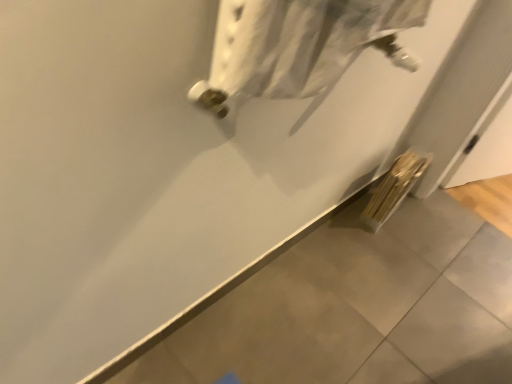
What do you see at coordinates (394, 188) in the screenshot? I see `wooden sticks at lower right` at bounding box center [394, 188].

Where is `wooden sticks at lower right`? This screenshot has height=384, width=512. wooden sticks at lower right is located at coordinates (394, 188).

This screenshot has width=512, height=384. In order to click on white textured towel at upper center in this screenshot , I will do `click(298, 47)`.

This screenshot has width=512, height=384. What do you see at coordinates (298, 47) in the screenshot?
I see `white textured towel at upper center` at bounding box center [298, 47].

In order to face white textured towel at upper center, should I rotate leftwards or rightwards?

Turn right approximately 4.911 degrees to face it.

Measure the distance between white textured towel at upper center and camera.

They are 55.57 centimeters apart.

This screenshot has height=384, width=512. I want to click on wooden sticks at lower right, so click(x=394, y=188).

Which object is positioned more to the left, wooden sticks at lower right or white textured towel at upper center?

From the viewer's perspective, white textured towel at upper center appears more on the left side.

Which object is closer to the camera taking this photo, wooden sticks at lower right or white textured towel at upper center?

white textured towel at upper center.

Is point (418, 160) closer or farther from the camera than point (362, 3)?

Point (418, 160) appears to be farther away from the viewer than point (362, 3).

From the image's perspective, is wooden sticks at lower right below white textured towel at upper center?

Yes, from the image's perspective, wooden sticks at lower right is below white textured towel at upper center.

From a real-world perspective, relative to white textured towel at upper center, is wooden sticks at lower right vertically above or below?

In terms of real-world spatial position, wooden sticks at lower right is below white textured towel at upper center.

Which object is thinner, wooden sticks at lower right or white textured towel at upper center?

white textured towel at upper center.

Who is taller, wooden sticks at lower right or white textured towel at upper center?

Standing taller between the two is wooden sticks at lower right.

Considering the sizes of wooden sticks at lower right and white textured towel at upper center in the image, is wooden sticks at lower right bigger or smaller than white textured towel at upper center?

In the image, wooden sticks at lower right appears to be larger than white textured towel at upper center.

Could white textured towel at upper center be considered to be inside wooden sticks at lower right?

No, white textured towel at upper center is not surrounded by wooden sticks at lower right.

Does wooden sticks at lower right touch white textured towel at upper center?

No, wooden sticks at lower right is not in contact with white textured towel at upper center.

Is wooden sticks at lower right turned away from white textured towel at upper center?

No, wooden sticks at lower right is not facing away from white textured towel at upper center.

Identify the location of wide located above the wooden sticks at lower right (from a real-world perspective). This screenshot has height=384, width=512. (298, 47).

Is white textured towel at upper center to the right of wooden sticks at lower right from the viewer's perspective?

Incorrect, white textured towel at upper center is not on the right side of wooden sticks at lower right.

Considering the positions of objects white textured towel at upper center and wooden sticks at lower right in the image provided, who is in front, white textured towel at upper center or wooden sticks at lower right?

Positioned in front is white textured towel at upper center.

Is point (258, 77) positioned behind point (413, 161)?

That is False.

From the image's perspective, between white textured towel at upper center and wooden sticks at lower right, who is located below?

From the image's view, wooden sticks at lower right is below.

From a real-world perspective, relative to wooden sticks at lower right, is white textured towel at upper center vertically above or below?

white textured towel at upper center is above wooden sticks at lower right.

Which of these two, white textured towel at upper center or wooden sticks at lower right, is wider?

wooden sticks at lower right is wider.

Who is shorter, white textured towel at upper center or wooden sticks at lower right?

white textured towel at upper center.

Does white textured towel at upper center have a larger size compared to wooden sticks at lower right?

Incorrect, white textured towel at upper center is not larger than wooden sticks at lower right.

Can wooden sticks at lower right be found inside white textured towel at upper center?

No, white textured towel at upper center does not contain wooden sticks at lower right.

Is white textured towel at upper center touching wooden sticks at lower right?

white textured towel at upper center and wooden sticks at lower right are clearly separated.

Is wooden sticks at lower right at the back of white textured towel at upper center?

No, white textured towel at upper center is not facing the opposite direction of wooden sticks at lower right.

Based on the photo, measure the distance between white textured towel at upper center and wooden sticks at lower right.

white textured towel at upper center is 97.34 centimeters away from wooden sticks at lower right.

Where is `radiator below the white textured towel at upper center (from the image's perspective)`? This screenshot has width=512, height=384. radiator below the white textured towel at upper center (from the image's perspective) is located at coordinates (394, 188).

This screenshot has height=384, width=512. Identify the location of radiator that is on the right side of white textured towel at upper center. (394, 188).

The width and height of the screenshot is (512, 384). What are the coordinates of `radiator below the white textured towel at upper center (from the image's perspective)` in the screenshot? It's located at (394, 188).